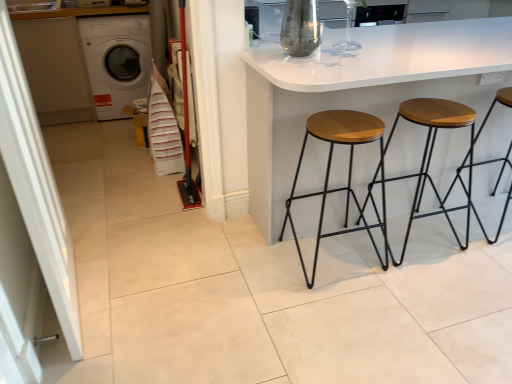
Question: From the image's perspective, is wooden barstools at center positioned above or below wooden seat at right, the 3th stool in the left-to-right sequence?

Choices:
 (A) above
 (B) below

Answer: (A)

Question: Is point (449, 77) positioned closer to the camera than point (505, 155)?

Choices:
 (A) closer
 (B) farther

Answer: (A)

Question: Which object is positioned closest to the wooden barstools at center?

Choices:
 (A) transparent glass vase at upper center
 (B) woodenmaterial/texturestool at center, marked as the 3th stool in a right-to-left arrangement
 (C) wooden/metallic stool at center, which is counted as the second stool, starting from the left
 (D) white striped fabric at left
 (E) wooden seat at right, positioned as the first stool in right-to-left order

Answer: (B)

Question: Estimate the real-world distances between objects in this image. Which object is farther from the wooden barstools at center?

Choices:
 (A) wooden/metallic stool at center, marked as the second stool in a right-to-left arrangement
 (B) transparent glass vase at upper center
 (C) woodenmaterial/texturestool at center, the 1th stool from the left
 (D) white glossy washing machine at left
 (E) wooden seat at right, positioned as the first stool in right-to-left order

Answer: (D)